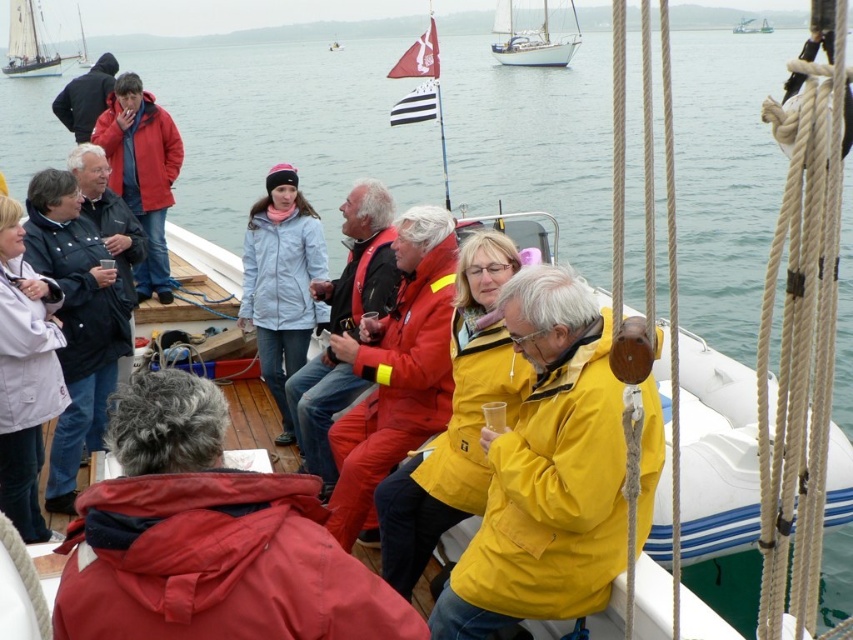
Who is lower down, dark blue jacket at upper left or white wooden sailboat at upper left?

dark blue jacket at upper left

You are a GUI agent. You are given a task and a screenshot of the screen. Output one action in this format:
    pyautogui.click(x=<x>, y=<y>)
    Task: Click on the dark blue jacket at upper left
    Image resolution: width=853 pixels, height=640 pixels.
    Given the screenshot: What is the action you would take?
    pyautogui.click(x=85, y=97)

Is matte light blue jacket at center positioned in front of white plastic boat at center?

Yes, it is in front of white plastic boat at center.

What do you see at coordinates (281, 282) in the screenshot? The image size is (853, 640). I see `matte light blue jacket at center` at bounding box center [281, 282].

The height and width of the screenshot is (640, 853). What are the coordinates of `matte light blue jacket at center` in the screenshot? It's located at pos(281,282).

Between matte red jacket at center and white glossy sailboat at upper center, which one is positioned lower?

matte red jacket at center

Does matte red jacket at center have a smaller size compared to white glossy sailboat at upper center?

Yes, matte red jacket at center is smaller than white glossy sailboat at upper center.

Describe the element at coordinates (363, 260) in the screenshot. This screenshot has height=640, width=853. I see `matte red jacket at center` at that location.

Identify the location of matte red jacket at center. (363, 260).